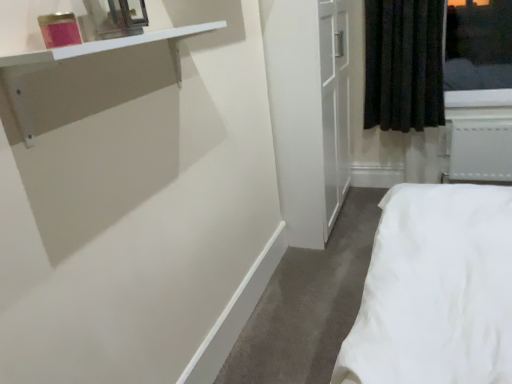
What do you see at coordinates (480, 151) in the screenshot? Image resolution: width=512 pixels, height=384 pixels. I see `white plastic radiator at lower right` at bounding box center [480, 151].

What do you see at coordinates (403, 64) in the screenshot? This screenshot has width=512, height=384. I see `black fabric curtain at upper right` at bounding box center [403, 64].

Find the location of a particular element. Image resolution: width=512 pixels, height=384 pixels. black fabric curtain at upper right is located at coordinates 403,64.

In order to click on white plastic radiator at lower right in this screenshot , I will do `click(480, 151)`.

Which is further, (476, 146) or (110, 8)?

Point (476, 146)

Is metallic mirror at upper left a part of white plastic radiator at lower right?

No, white plastic radiator at lower right does not contain metallic mirror at upper left.

The image size is (512, 384). Identify the location of medicine cabinet in front of the white plastic radiator at lower right. (117, 17).

From a real-world perspective, who is located higher, white plastic radiator at lower right or metallic mirror at upper left?

metallic mirror at upper left is physically above.

From a real-world perspective, is white glossy shelf at upper left on top of black fabric curtain at upper right?

Yes, from a real-world perspective, white glossy shelf at upper left is on top of black fabric curtain at upper right.

From the image's perspective, who appears lower, white glossy shelf at upper left or black fabric curtain at upper right?

white glossy shelf at upper left, from the image's perspective.

Locate an element on the screen. The image size is (512, 384). vanity above the black fabric curtain at upper right (from a real-world perspective) is located at coordinates (79, 56).

Considering the sizes of white glossy shelf at upper left and black fabric curtain at upper right in the image, is white glossy shelf at upper left wider or thinner than black fabric curtain at upper right?

In the image, white glossy shelf at upper left appears to be more narrow than black fabric curtain at upper right.

From the image's perspective, is white plastic radiator at lower right located above or below black fabric curtain at upper right?

From the image's perspective, white plastic radiator at lower right appears below black fabric curtain at upper right.

In terms of width, does white plastic radiator at lower right look wider or thinner when compared to black fabric curtain at upper right?

Considering their sizes, white plastic radiator at lower right looks slimmer than black fabric curtain at upper right.

Which is behind, point (451, 128) or point (381, 119)?

The point (451, 128) is farther from the camera.

Between white plastic radiator at lower right and black fabric curtain at upper right, which one has larger size?

black fabric curtain at upper right is bigger.

Where is `vanity in front of the white plastic radiator at lower right`? vanity in front of the white plastic radiator at lower right is located at coordinates (79, 56).

Is point (67, 47) positioned behind point (481, 124)?

That is False.

Can you tell me how much white glossy shelf at upper left and white plastic radiator at lower right differ in facing direction?

white glossy shelf at upper left and white plastic radiator at lower right are facing 90.2 degrees away from each other.

From a real-world perspective, who is located higher, white glossy shelf at upper left or white plastic radiator at lower right?

In real-world perspective, white glossy shelf at upper left is above.

From a real-world perspective, which object stands above the other?

In real-world perspective, metallic mirror at upper left is above.

Can you confirm if metallic mirror at upper left is thinner than white plastic radiator at lower right?

In fact, metallic mirror at upper left might be wider than white plastic radiator at lower right.

Is metallic mirror at upper left positioned beyond the bounds of white plastic radiator at lower right?

Yes, metallic mirror at upper left is located beyond the bounds of white plastic radiator at lower right.

Does metallic mirror at upper left have a smaller size compared to white plastic radiator at lower right?

Indeed, metallic mirror at upper left has a smaller size compared to white plastic radiator at lower right.

Considering the positions of objects black fabric curtain at upper right and white glossy shelf at upper left in the image provided, who is in front, black fabric curtain at upper right or white glossy shelf at upper left?

white glossy shelf at upper left.

The height and width of the screenshot is (384, 512). Identify the location of vanity in front of the black fabric curtain at upper right. (79, 56).

Considering the positions of objects black fabric curtain at upper right and white glossy shelf at upper left in the image provided, who is more to the left, black fabric curtain at upper right or white glossy shelf at upper left?

white glossy shelf at upper left.

From the image's perspective, which one is positioned lower, black fabric curtain at upper right or white glossy shelf at upper left?

white glossy shelf at upper left appears lower in the image.

Could you tell me if white glossy shelf at upper left is turned towards metallic mirror at upper left?

No, white glossy shelf at upper left is not turned towards metallic mirror at upper left.

Where is `medicine cabinet behind the white glossy shelf at upper left`? This screenshot has width=512, height=384. medicine cabinet behind the white glossy shelf at upper left is located at coordinates (117, 17).

Would you say white glossy shelf at upper left is outside metallic mirror at upper left?

Yes, white glossy shelf at upper left is not within metallic mirror at upper left.

From a real-world perspective, which is physically above, white glossy shelf at upper left or metallic mirror at upper left?

From a 3D spatial view, metallic mirror at upper left is above.

The width and height of the screenshot is (512, 384). What are the coordinates of `medicine cabinet in front of the white plastic radiator at lower right` in the screenshot? It's located at (117, 17).

The width and height of the screenshot is (512, 384). Identify the location of curtain behind the white glossy shelf at upper left. (403, 64).

Based on their spatial positions, is metallic mirror at upper left or white glossy shelf at upper left further from black fabric curtain at upper right?

Among the two, metallic mirror at upper left is located further to black fabric curtain at upper right.

From the picture: Which object lies further to the anchor point black fabric curtain at upper right, white plastic radiator at lower right or white glossy shelf at upper left?

white glossy shelf at upper left is further to black fabric curtain at upper right.

Estimate the real-world distances between objects in this image. Which object is closer to black fabric curtain at upper right, metallic mirror at upper left or white plastic radiator at lower right?

white plastic radiator at lower right is positioned closer to the anchor black fabric curtain at upper right.

Considering their positions, is black fabric curtain at upper right positioned closer to white plastic radiator at lower right than metallic mirror at upper left?

black fabric curtain at upper right.

Estimate the real-world distances between objects in this image. Which object is further from metallic mirror at upper left, white glossy shelf at upper left or white plastic radiator at lower right?

white plastic radiator at lower right is positioned further to the anchor metallic mirror at upper left.

Based on their spatial positions, is white glossy shelf at upper left or metallic mirror at upper left closer to white plastic radiator at lower right?

The object closer to white plastic radiator at lower right is white glossy shelf at upper left.

From the image, which object appears to be farther from white plastic radiator at lower right, metallic mirror at upper left or black fabric curtain at upper right?

metallic mirror at upper left is positioned further to the anchor white plastic radiator at lower right.

Considering their positions, is black fabric curtain at upper right positioned closer to metallic mirror at upper left than white plastic radiator at lower right?

black fabric curtain at upper right is closer to metallic mirror at upper left.

I want to click on medicine cabinet located between white glossy shelf at upper left and white plastic radiator at lower right in the depth direction, so click(117, 17).

Locate an element on the screen. medicine cabinet located between white glossy shelf at upper left and black fabric curtain at upper right in the depth direction is located at coordinates [x=117, y=17].

What are the coordinates of `curtain between white glossy shelf at upper left and white plastic radiator at lower right along the z-axis` in the screenshot? It's located at (403, 64).

I want to click on curtain located between metallic mirror at upper left and white plastic radiator at lower right in the depth direction, so click(403, 64).